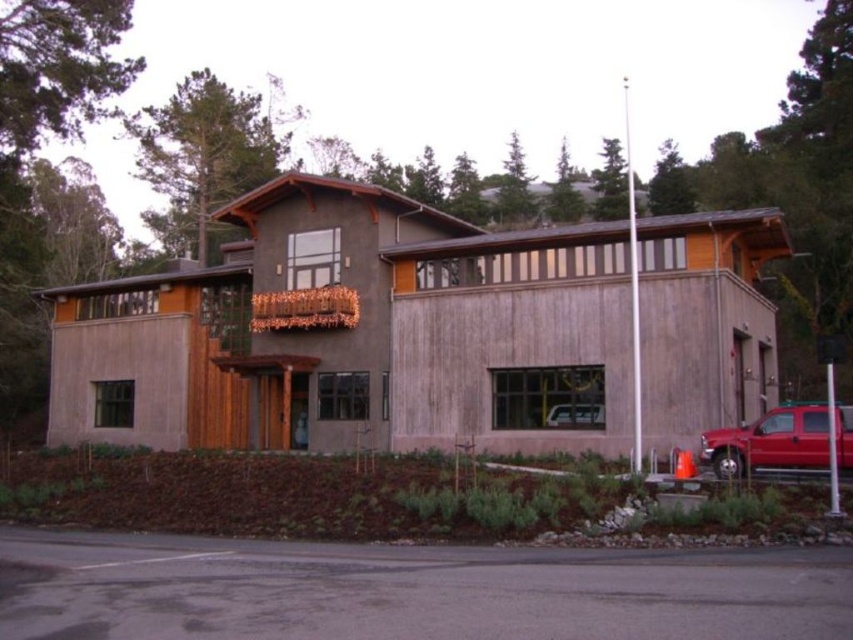
Is brown mulch at lower left below metallic silver car at center?

Result: Correct, brown mulch at lower left is located below metallic silver car at center.

Consider the image. Who is more forward, (274, 536) or (573, 403)?

Point (274, 536)

This screenshot has width=853, height=640. What are the coordinates of `brown mulch at lower left` in the screenshot? It's located at (296, 496).

Between matte red truck at lower right and metallic silver car at center, which one has less height?

Standing shorter between the two is metallic silver car at center.

Does point (839, 468) come in front of point (577, 408)?

Yes, point (839, 468) is closer to viewer.

The width and height of the screenshot is (853, 640). Find the location of `matte red truck at lower right`. matte red truck at lower right is located at coordinates (770, 442).

Does brown mulch at lower left have a lesser height compared to matte red truck at lower right?

Incorrect, brown mulch at lower left's height does not fall short of matte red truck at lower right's.

Is brown mulch at lower left wider than matte red truck at lower right?

Correct, the width of brown mulch at lower left exceeds that of matte red truck at lower right.

Who is more forward, [555,513] or [720,440]?

Point [555,513]

The width and height of the screenshot is (853, 640). What are the coordinates of `brown mulch at lower left` in the screenshot? It's located at (296, 496).